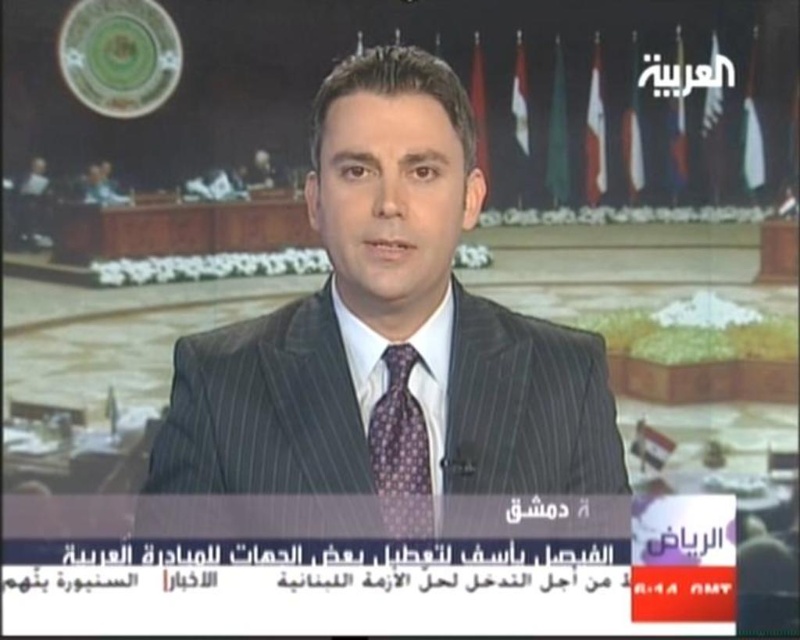
Who is positioned more to the right, dark gray pinstripe suit at center or purple dotted tie at center?

dark gray pinstripe suit at center

Who is more forward, (450, 440) or (408, 451)?

Positioned in front is point (408, 451).

This screenshot has height=640, width=800. I want to click on dark gray pinstripe suit at center, so click(384, 344).